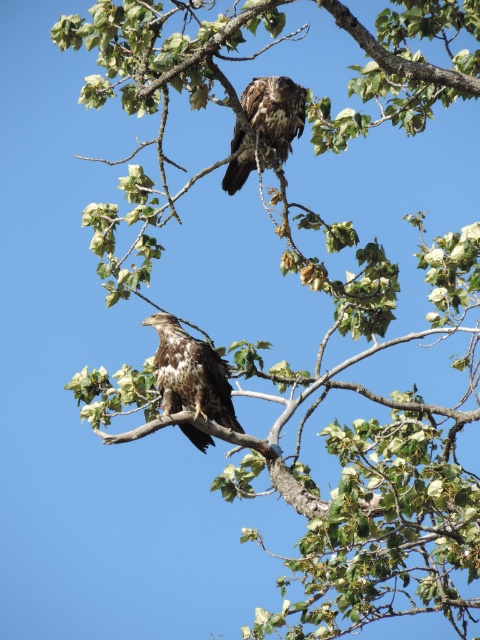
Between brown speckled feathers at center and dark brown feathers at upper center, which one has more height?

brown speckled feathers at center is taller.

Where is `brown speckled feathers at center`? The height and width of the screenshot is (640, 480). brown speckled feathers at center is located at coordinates (191, 372).

Does point (197, 362) come closer to viewer compared to point (231, 180)?

That is True.

In order to click on brown speckled feathers at center in this screenshot , I will do `click(191, 372)`.